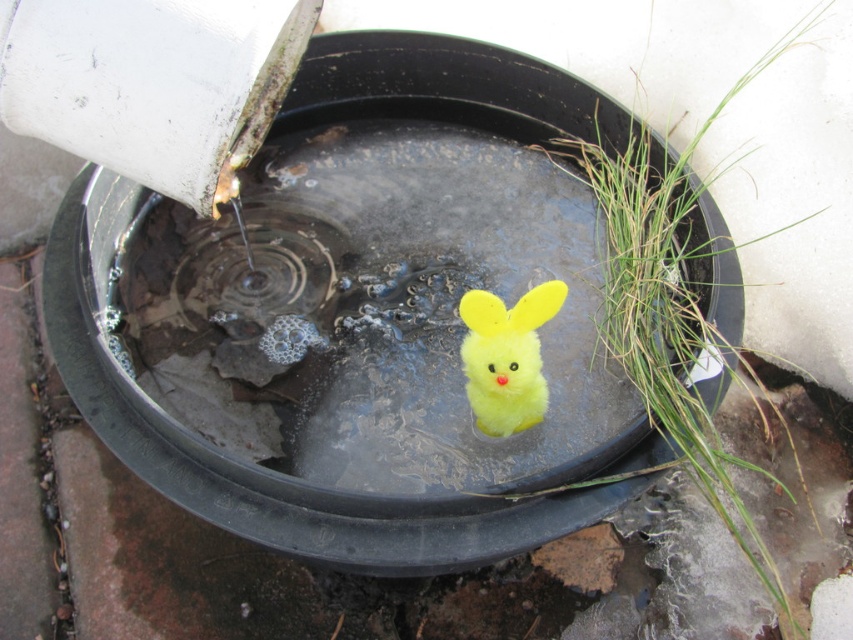
Is yellow plush toy at center wider than fluffy yellow plush at center?

Correct, the width of yellow plush toy at center exceeds that of fluffy yellow plush at center.

Which is above, yellow plush toy at center or fluffy yellow plush at center?

yellow plush toy at center

Locate an element on the screen. The width and height of the screenshot is (853, 640). yellow plush toy at center is located at coordinates (372, 310).